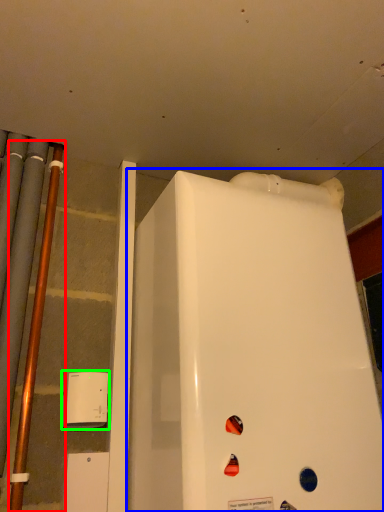
Question: Which object is positioned closest to pipe (highlighted by a red box)? Select from refrigerator (highlighted by a blue box) and appliance (highlighted by a green box).

Choices:
 (A) refrigerator
 (B) appliance

Answer: (B)